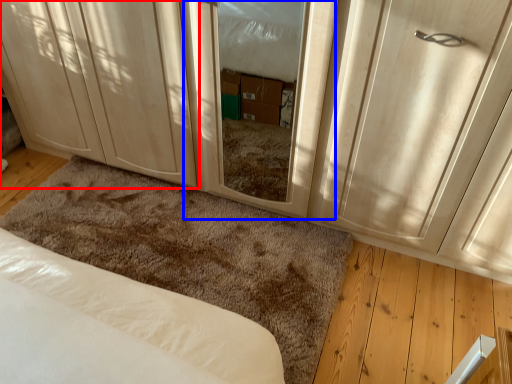
Question: Which of the following is the closest to the observer, cabinetry (highlighted by a red box) or screen door (highlighted by a blue box)?

Choices:
 (A) cabinetry
 (B) screen door

Answer: (B)